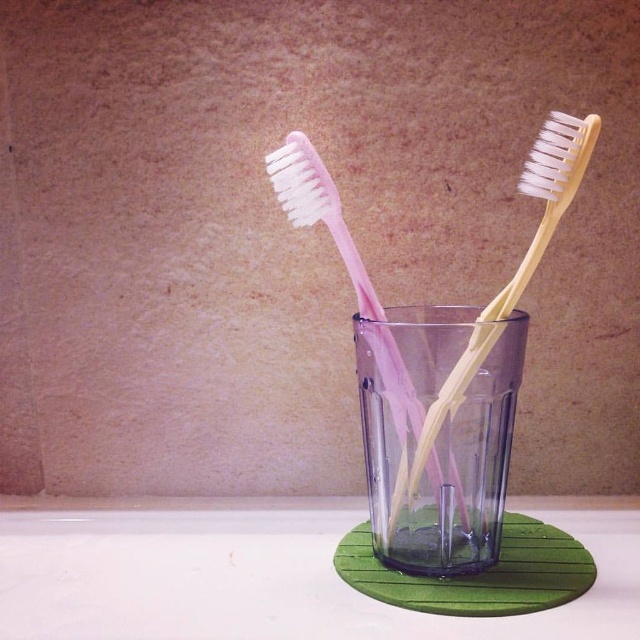
You are trying to place a small decorative stone on the transparent plastic cup at center. The coordinates given are point [444,464]. Is this point on the cup?

Yes, the point [444,464] is on the transparent plastic cup at center according to the description.

You have a small container that is 10 inches wide. Can you fit both the pink toothbrush on the left and the yellow matte toothbrush at center into it without overlapping?

The distance between the pink toothbrush on the left and the yellow matte toothbrush at center is 11.74 inches. Since the container is only 10 inches wide, they cannot fit without overlapping.

You are holding a small object that is 10 inches long and want to place it between the two toothbrushes in the cup. Based on the distance of point (x=467, y=339) from the viewer, will the object fit in the space between the toothbrushes?

The distance of point (x=467, y=339) from viewer is 12.41 inches, which is greater than the object length of 10 inches. Therefore, the object will fit in the space between the toothbrushes.